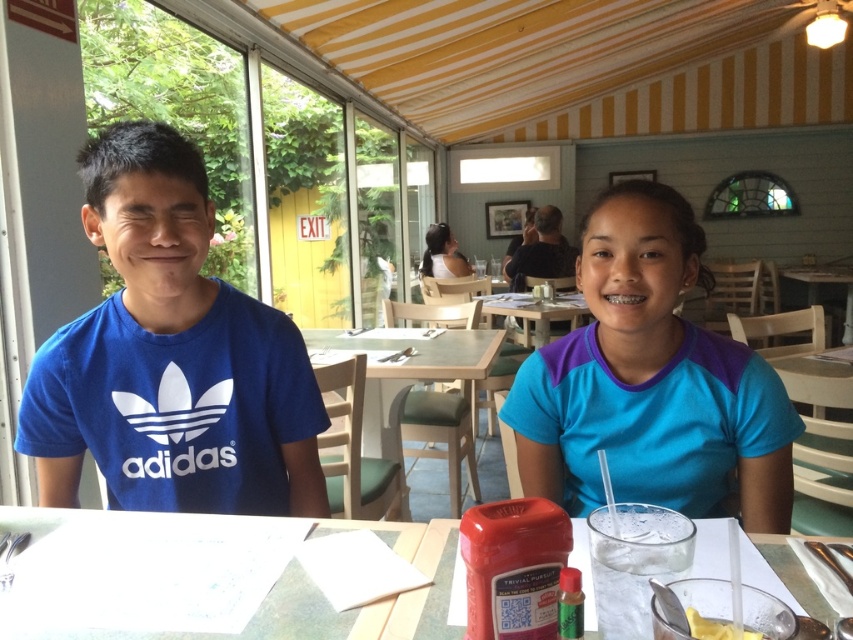
Is blue cotton shirt at left below matte black shirt at center?

Yes.

Can you confirm if blue cotton shirt at left is positioned to the right of matte black shirt at center?

In fact, blue cotton shirt at left is to the left of matte black shirt at center.

The width and height of the screenshot is (853, 640). Find the location of `blue cotton shirt at left`. blue cotton shirt at left is located at coordinates (170, 356).

Who is positioned more to the left, clear glass table at center or wooden table at center?

From the viewer's perspective, clear glass table at center appears more on the left side.

Is point (305, 580) closer to viewer compared to point (583, 304)?

Yes, it is in front of point (583, 304).

This screenshot has height=640, width=853. I want to click on clear glass table at center, so click(325, 600).

Locate an element on the screen. This screenshot has height=640, width=853. clear glass table at center is located at coordinates (325, 600).

Does point (131, 244) lie in front of point (543, 340)?

Yes.

Does blue cotton shirt at left have a smaller size compared to wooden table at center?

Indeed, blue cotton shirt at left has a smaller size compared to wooden table at center.

Is point (161, 445) positioned before point (535, 326)?

Yes, point (161, 445) is closer to viewer.

Identify the location of blue cotton shirt at left. This screenshot has height=640, width=853. (170, 356).